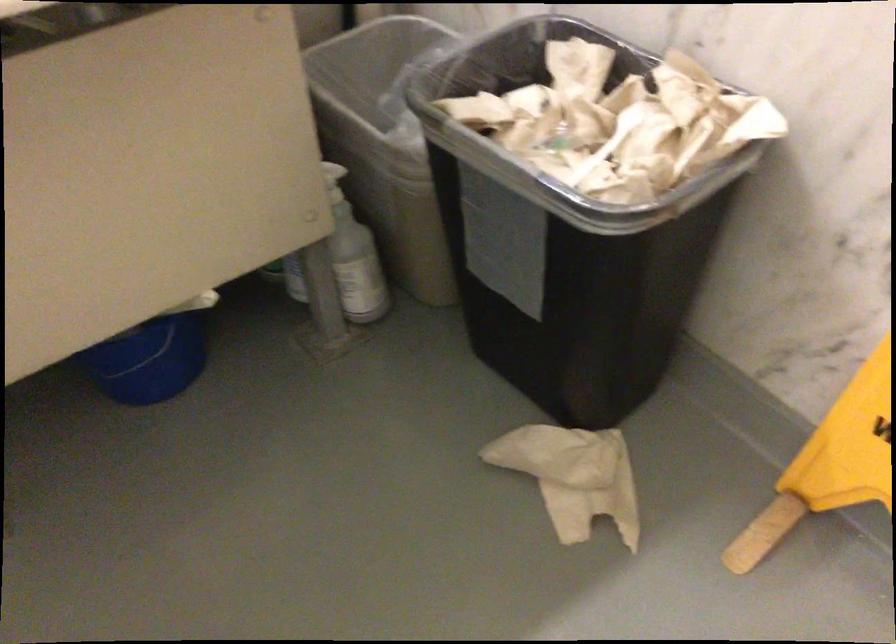
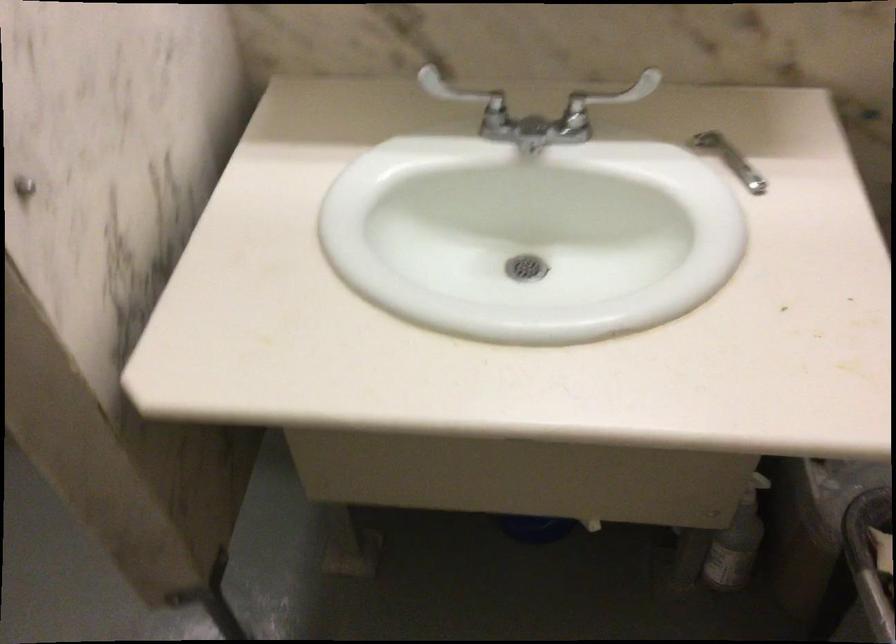
Locate, in the second image, the point that corresponds to (364,257) in the first image.

(737, 542)